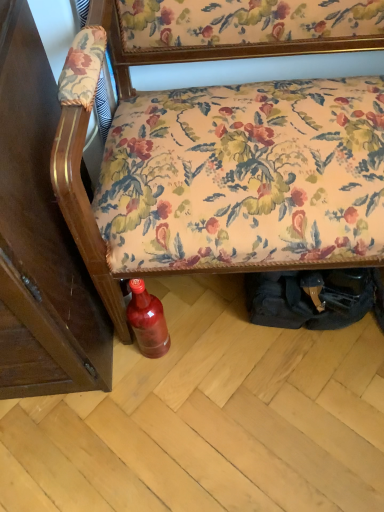
Question: Should I look upward or downward to see floral fabric sofa at center?

Choices:
 (A) down
 (B) up

Answer: (B)